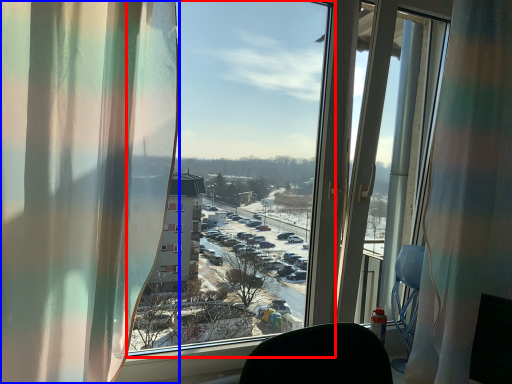
Question: Which object appears farthest to the camera in this image, window screen (highlighted by a red box) or curtain (highlighted by a blue box)?

Choices:
 (A) window screen
 (B) curtain

Answer: (A)